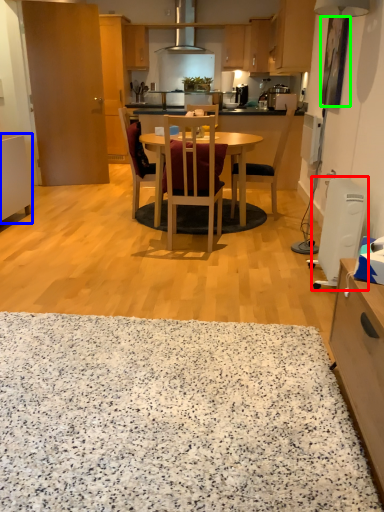
Question: Based on their relative distances, which object is farther from appliance (highlighted by a red box)? Choose from cabinetry (highlighted by a blue box) and picture frame (highlighted by a green box).

Choices:
 (A) cabinetry
 (B) picture frame

Answer: (A)